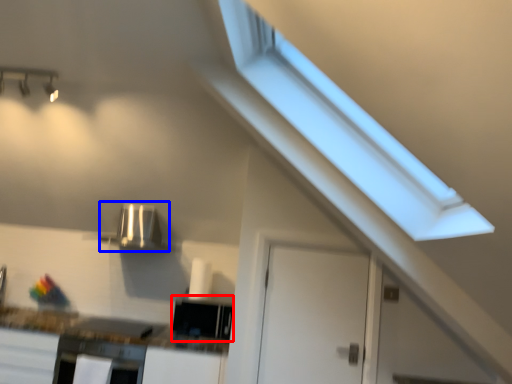
Question: Which of the following is the closest to the observer, appliance (highlighted by a red box) or appliance (highlighted by a blue box)?

Choices:
 (A) appliance
 (B) appliance

Answer: (A)